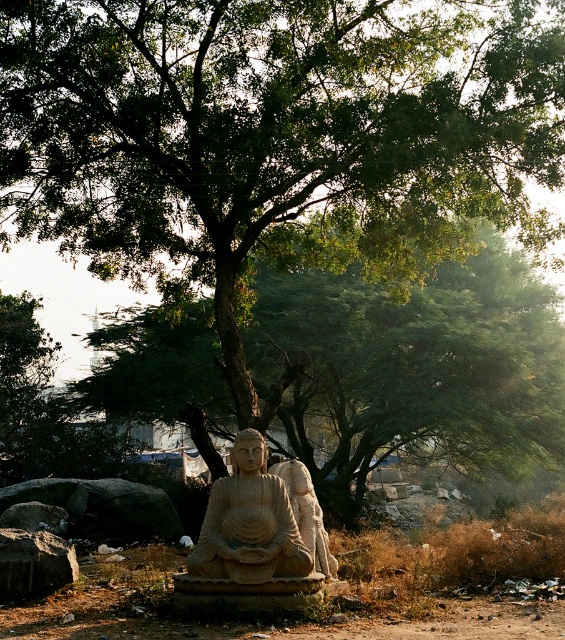
In the scene shown: You are a gardener who needs to place a new 7 feet long wooden bench between the brown dirt field at center and the rough gray rock at lower left. Can the bench fit in the space between them?

The distance between the brown dirt field at center and the rough gray rock at lower left is 6.92 feet, which is slightly shorter than the 7 feet long bench. Therefore, the bench cannot fit in the space between them.